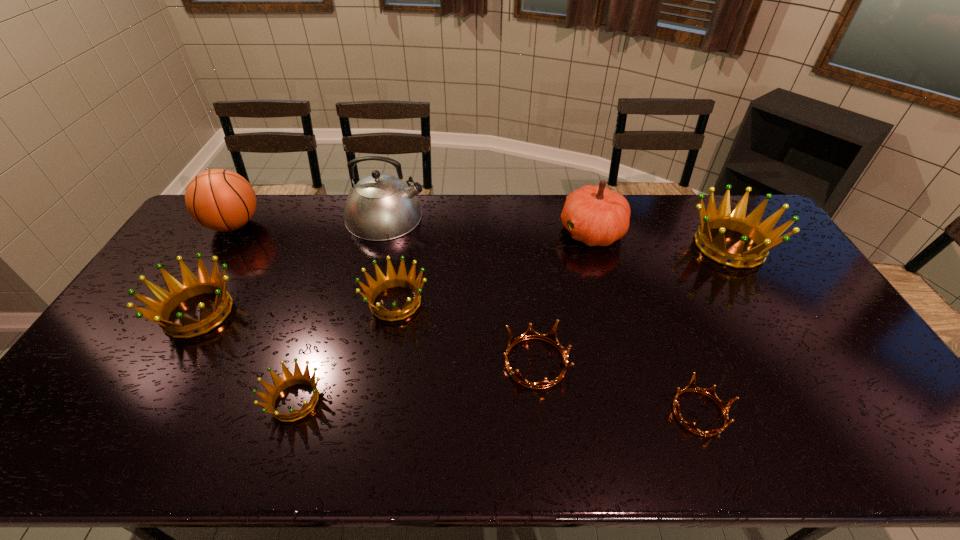
You are a GUI agent. You are given a task and a screenshot of the screen. Output one action in this format:
    pyautogui.click(x=<x>, y=<y>)
    Task: Click on the basketball situated at the left edge
    
    Given the screenshot: What is the action you would take?
    pyautogui.click(x=221, y=200)

Find the location of a particular element. The height and width of the screenshot is (540, 960). crown at the left edge is located at coordinates (160, 310).

In order to click on object situated at the right edge in this screenshot , I will do `click(760, 233)`.

Locate an element on the screen. This screenshot has height=540, width=960. object positioned at the far left corner is located at coordinates (221, 200).

Find the location of a particular element. Image resolution: width=960 pixels, height=540 pixels. object that is positioned at the far right corner is located at coordinates (760, 233).

I want to click on free spot at the far edge of the desktop, so click(x=682, y=218).

This screenshot has width=960, height=540. In the image, there is a desktop. What are the coordinates of `vacant space at the left edge` in the screenshot? It's located at (191, 301).

This screenshot has height=540, width=960. Find the location of `vacant space at the far right corner`. vacant space at the far right corner is located at coordinates (706, 196).

The height and width of the screenshot is (540, 960). Identify the location of vacant space that's between the second crown from right to left and the basketball. (467, 319).

In order to click on vacant area that lies between the pumpkin and the third golden crown from right to left in this screenshot , I will do pos(444,316).